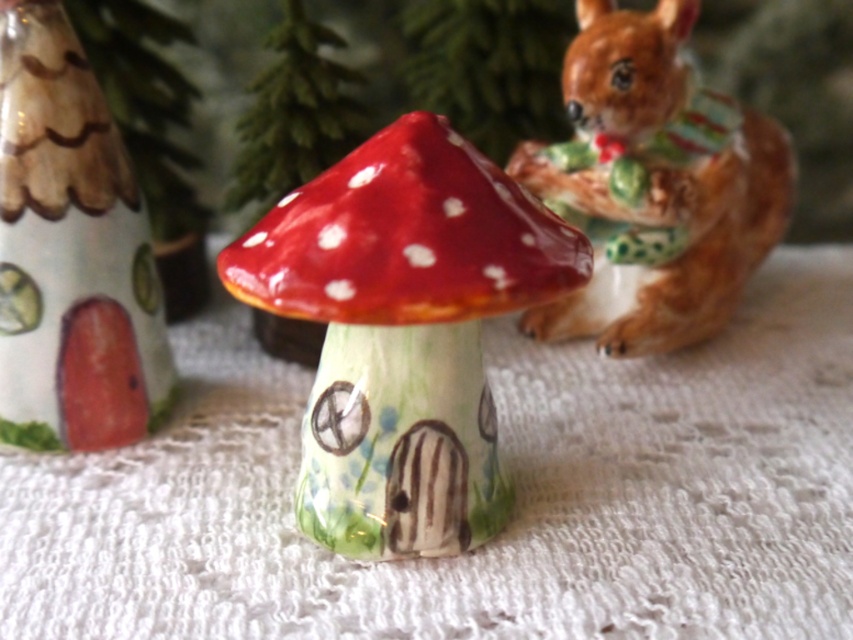
Is white lace tablecloth at center positioned at the back of glossy ceramic mushroom at center?

Yes, it is behind glossy ceramic mushroom at center.

Does white lace tablecloth at center have a lesser width compared to glossy ceramic mushroom at center?

No.

This screenshot has height=640, width=853. In order to click on white lace tablecloth at center in this screenshot , I will do `click(515, 496)`.

Who is taller, white lace tablecloth at center or brown glossy squirrel at upper right?

brown glossy squirrel at upper right

Is white lace tablecloth at center shorter than brown glossy squirrel at upper right?

Indeed, white lace tablecloth at center has a lesser height compared to brown glossy squirrel at upper right.

Between point (242, 376) and point (764, 152), which one is positioned in front?

Point (764, 152) is more forward.

Identify the location of white lace tablecloth at center. Image resolution: width=853 pixels, height=640 pixels. (515, 496).

Between point (540, 243) and point (635, 168), which one is positioned in front?

Point (540, 243)

Is point (492, 504) positioned after point (640, 314)?

No.

Locate an element on the screen. Image resolution: width=853 pixels, height=640 pixels. glossy ceramic mushroom at center is located at coordinates (403, 332).